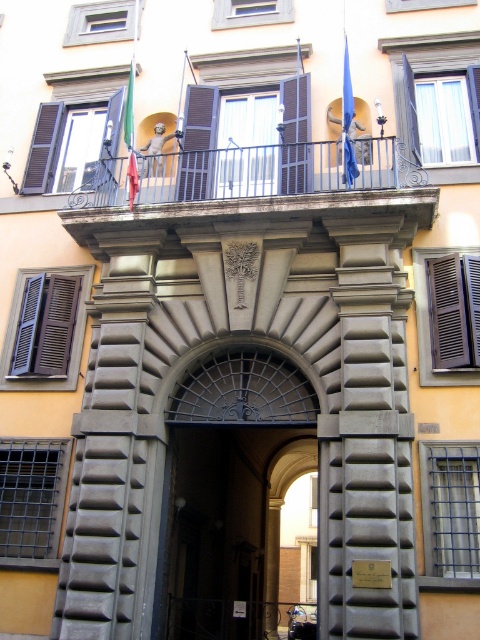
Question: Is dark gray stone archway at center to the left of green fabric flag at upper center from the viewer's perspective?

Choices:
 (A) yes
 (B) no

Answer: (B)

Question: Is the position of dark gray stone archway at center less distant than that of dark gray wooden shutter at left?

Choices:
 (A) no
 (B) yes

Answer: (B)

Question: Among these points, which one is farthest from the camera?

Choices:
 (A) [x=123, y=160]
 (B) [x=184, y=102]
 (C) [x=41, y=188]
 (D) [x=179, y=532]

Answer: (B)

Question: In this image, where is dark gray stone archway at center located relative to metallic gray railing at upper center?

Choices:
 (A) above
 (B) below

Answer: (B)

Question: Which of the following is the closest to the observer?

Choices:
 (A) brown wooden shutters at upper center
 (B) brown wooden shutter at right
 (C) brown wooden shutter at upper center

Answer: (B)

Question: Estimate the real-world distances between objects in this image. Which object is closer to the dark gray wooden shutter at left?

Choices:
 (A) metallic gray railing at upper center
 (B) brown wooden shutter at left
 (C) blue fabric flag at upper center

Answer: (B)